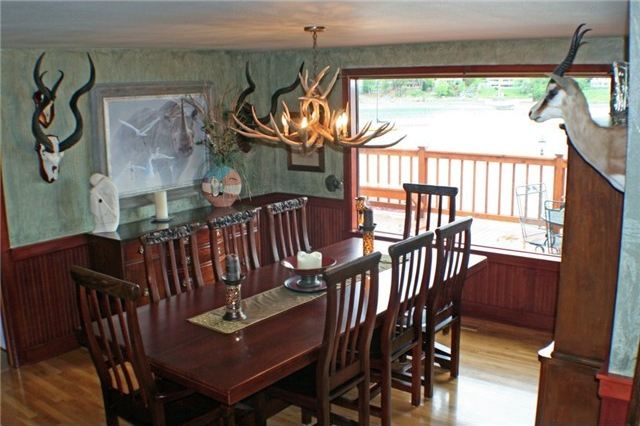
Where is `dining table`? This screenshot has height=426, width=640. dining table is located at coordinates [186, 336].